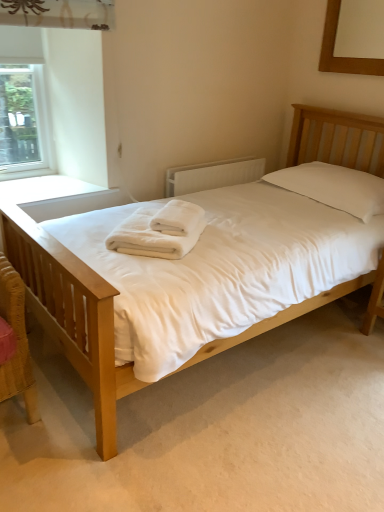
Question: From a real-world perspective, is white soft towel at center, placed as the second bath towel when sorted from bottom to top, positioned above or below wooden picture frame at upper right?

Choices:
 (A) above
 (B) below

Answer: (B)

Question: From their relative heights in the image, would you say white soft towel at center, placed as the second bath towel when sorted from bottom to top, is taller or shorter than wooden picture frame at upper right?

Choices:
 (A) short
 (B) tall

Answer: (A)

Question: Which object is positioned farthest from the white soft towel at center, placed as the 1th bath towel when sorted from top to bottom?

Choices:
 (A) white textured radiator at center
 (B) light wood bed at center
 (C) clear glass window at upper left
 (D) wooden picture frame at upper right
 (E) white soft towel at center, which appears as the second bath towel when viewed from the top

Answer: (D)

Question: Which is farther from the light wood bed at center?

Choices:
 (A) white soft towel at center, which appears as the second bath towel when viewed from the top
 (B) white textured radiator at center
 (C) wooden picture frame at upper right
 (D) clear glass window at upper left
 (E) white soft towel at center, placed as the second bath towel when sorted from bottom to top

Answer: (C)